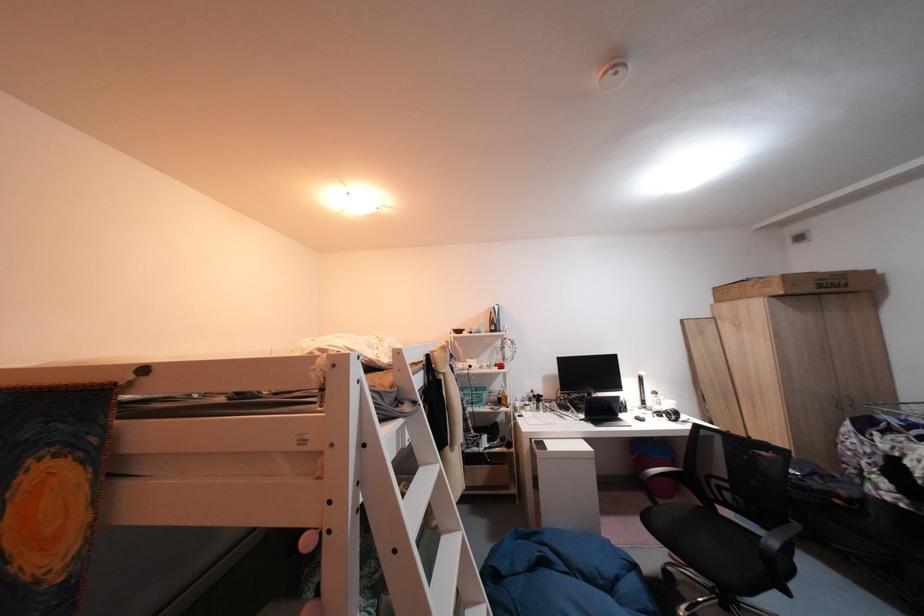
In order to click on white ladder rung in this screenshot , I will do `click(416, 515)`.